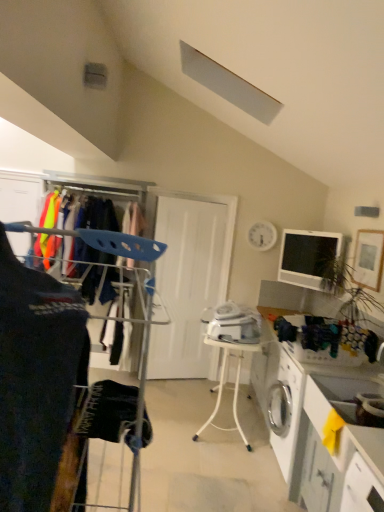
Question: Should I look upward or downward to see dark blue fabric at left?

Choices:
 (A) up
 (B) down

Answer: (B)

Question: Can you confirm if white glossy counter at lower right, marked as the second counter in a front-to-back arrangement, is smaller than dark blue fabric at left?

Choices:
 (A) no
 (B) yes

Answer: (A)

Question: Is white glossy counter at lower right, marked as the second counter in a front-to-back arrangement, not inside dark blue fabric at left?

Choices:
 (A) no
 (B) yes

Answer: (B)

Question: Is white glossy counter at lower right, marked as the second counter in a front-to-back arrangement, to the right of dark blue fabric at left from the viewer's perspective?

Choices:
 (A) yes
 (B) no

Answer: (A)

Question: From a real-world perspective, is white glossy counter at lower right, marked as the second counter in a front-to-back arrangement, located higher than dark blue fabric at left?

Choices:
 (A) yes
 (B) no

Answer: (B)

Question: Can you confirm if white glossy counter at lower right, marked as the second counter in a front-to-back arrangement, is positioned to the left of dark blue fabric at left?

Choices:
 (A) yes
 (B) no

Answer: (B)

Question: From a real-world perspective, is white glossy counter at lower right, marked as the second counter in a front-to-back arrangement, beneath dark blue fabric at left?

Choices:
 (A) yes
 (B) no

Answer: (A)

Question: Is dark blue fabric at left taller than white matte door at center?

Choices:
 (A) no
 (B) yes

Answer: (A)

Question: Is dark blue fabric at left not near white matte door at center?

Choices:
 (A) yes
 (B) no

Answer: (A)

Question: Is the position of dark blue fabric at left less distant than that of white matte door at center?

Choices:
 (A) no
 (B) yes

Answer: (B)

Question: Is dark blue fabric at left touching white matte door at center?

Choices:
 (A) no
 (B) yes

Answer: (A)

Question: Does dark blue fabric at left have a larger size compared to white matte door at center?

Choices:
 (A) no
 (B) yes

Answer: (A)

Question: From a real-world perspective, is dark blue fabric at left below white matte door at center?

Choices:
 (A) yes
 (B) no

Answer: (B)

Question: Considering the relative positions of matte black monitor at upper right and white plastic table at center in the image provided, is matte black monitor at upper right to the right of white plastic table at center from the viewer's perspective?

Choices:
 (A) no
 (B) yes

Answer: (B)